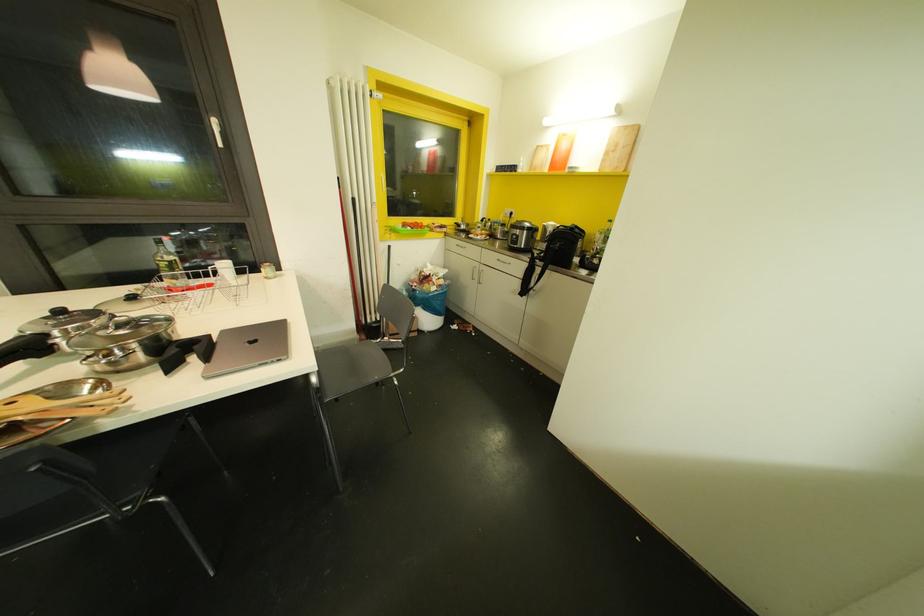
Image resolution: width=924 pixels, height=616 pixels. Describe the element at coordinates (25, 347) in the screenshot. I see `a black pot handle` at that location.